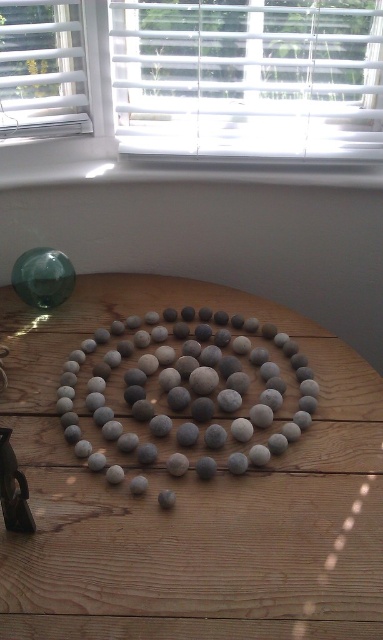
Question: Considering the relative positions of white plastic blinds at upper center and white plastic window sill at upper center in the image provided, where is white plastic blinds at upper center located with respect to white plastic window sill at upper center?

Choices:
 (A) below
 (B) above

Answer: (B)

Question: Which object is farther from the camera taking this photo?

Choices:
 (A) white plastic blinds at upper center
 (B) smooth gray pebbles at center
 (C) transparent plastic window at upper left

Answer: (A)

Question: Which is farther from the wooden table at center?

Choices:
 (A) white plastic blinds at upper center
 (B) white plastic window sill at upper center
 (C) smooth gray pebbles at center
 (D) transparent plastic window at upper left

Answer: (D)

Question: Does white plastic blinds at upper center come in front of smooth gray pebbles at center?

Choices:
 (A) no
 (B) yes

Answer: (A)

Question: Does wooden table at center lie behind white plastic window sill at upper center?

Choices:
 (A) no
 (B) yes

Answer: (A)

Question: Which object is the farthest from the transparent plastic window at upper left?

Choices:
 (A) smooth gray pebbles at center
 (B) white plastic blinds at upper center

Answer: (A)